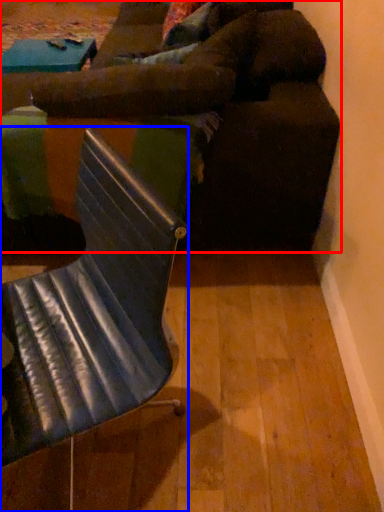
Question: Among these objects, which one is nearest to the camera, studio couch (highlighted by a red box) or chair (highlighted by a blue box)?

Choices:
 (A) studio couch
 (B) chair

Answer: (B)